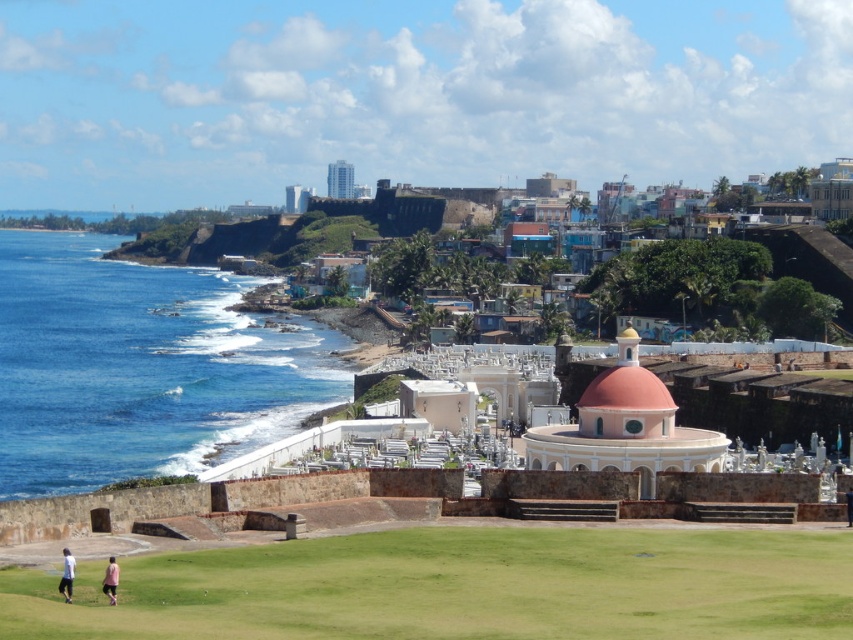
Does pink matte dome at center have a smaller size compared to pink fabric person at lower left?

Incorrect, pink matte dome at center is not smaller in size than pink fabric person at lower left.

In order to click on pink matte dome at center in this screenshot , I will do `click(625, 428)`.

Identify the location of green grass at lower center. (462, 586).

The height and width of the screenshot is (640, 853). Describe the element at coordinates (462, 586) in the screenshot. I see `green grass at lower center` at that location.

In order to click on green grass at lower center in this screenshot , I will do `click(462, 586)`.

Looking at this image, between green grass at lower center and pink fabric person at lower left, which one is positioned higher?

Positioned higher is pink fabric person at lower left.

Who is shorter, green grass at lower center or pink fabric person at lower left?

green grass at lower center

Which is behind, point (705, 628) or point (109, 582)?

Point (109, 582)

Locate an element on the screen. This screenshot has width=853, height=640. green grass at lower center is located at coordinates (462, 586).